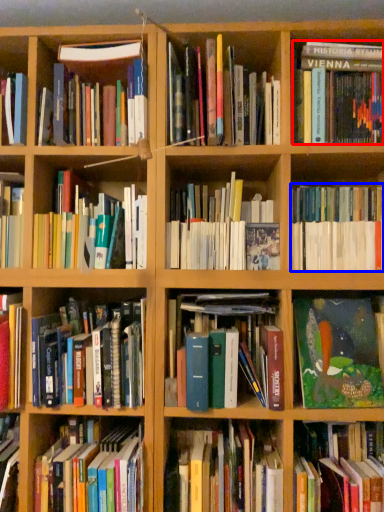
Question: Which object appears farthest to the camera in this image, book (highlighted by a red box) or book (highlighted by a blue box)?

Choices:
 (A) book
 (B) book

Answer: (A)